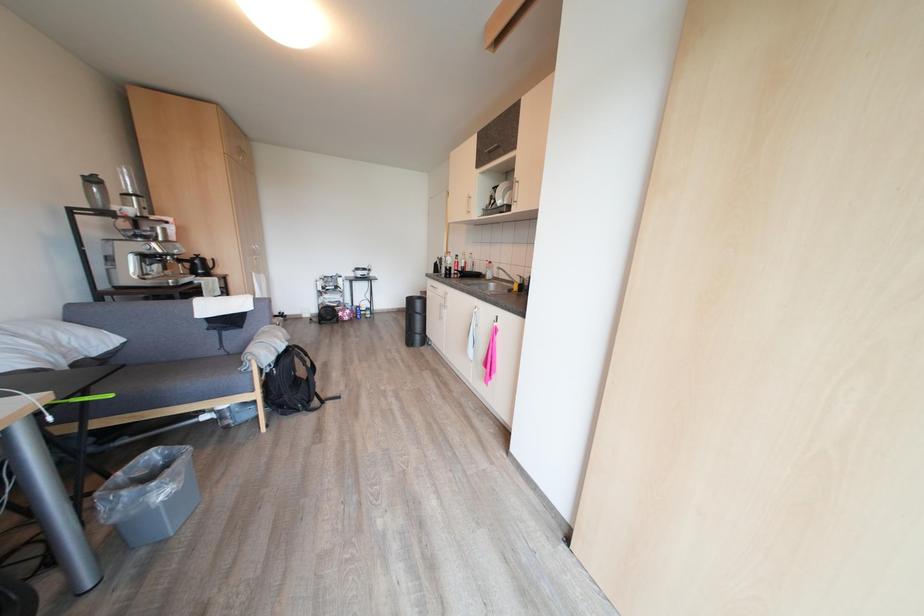
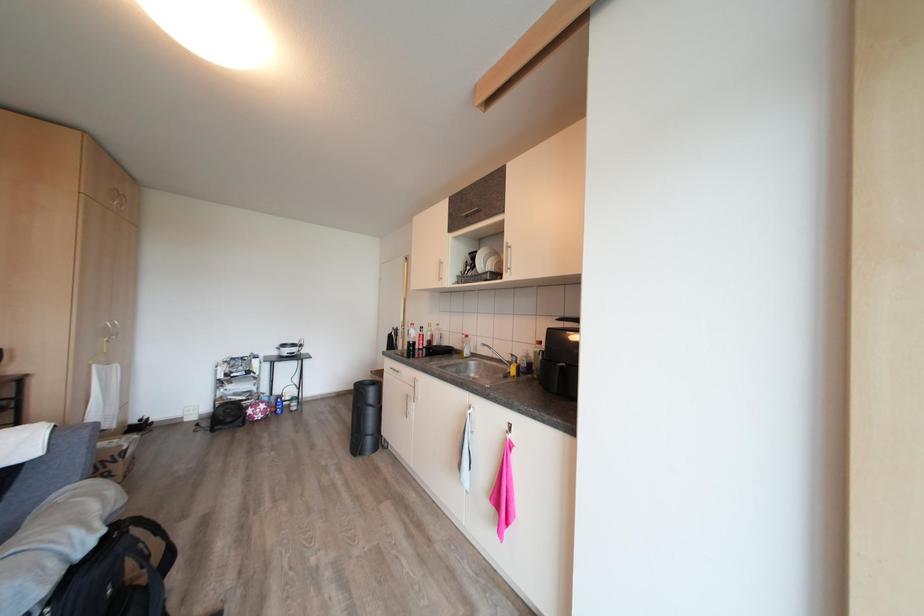
Question: The first image is from the beginning of the video and the second image is from the end. How did the camera likely rotate when shooting the video?

Choices:
 (A) Left
 (B) Right
 (C) Up
 (D) Down

Answer: (C)